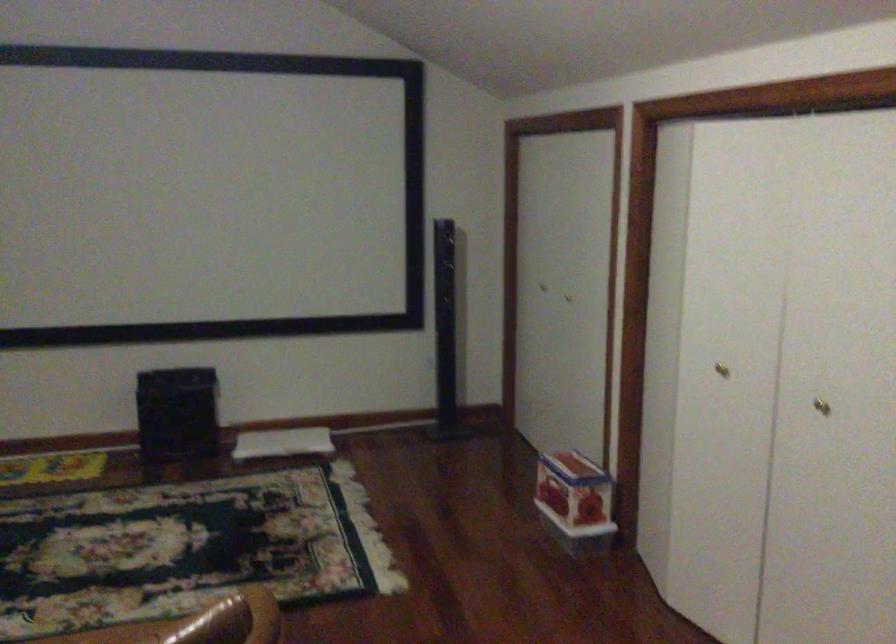
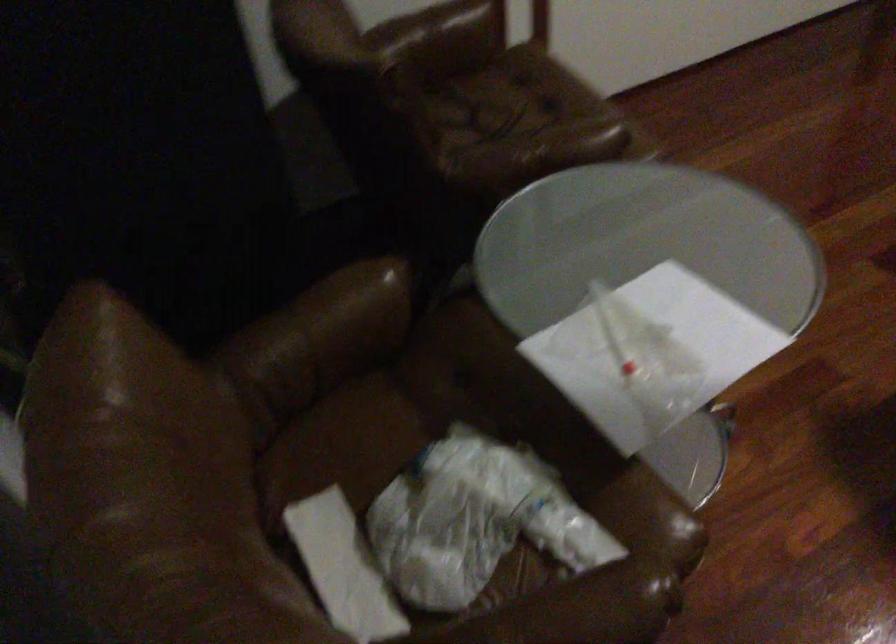
Based on the continuous images, in which direction is the camera rotating?

The camera's rotation is toward left-down.